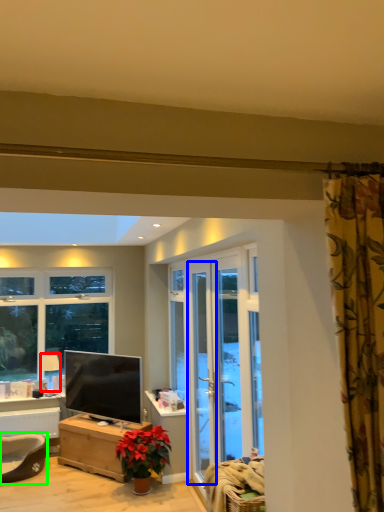
Question: Which is farther away from lamp (highlighted by a red box)? screen door (highlighted by a blue box) or swivel chair (highlighted by a green box)?

Choices:
 (A) screen door
 (B) swivel chair

Answer: (A)